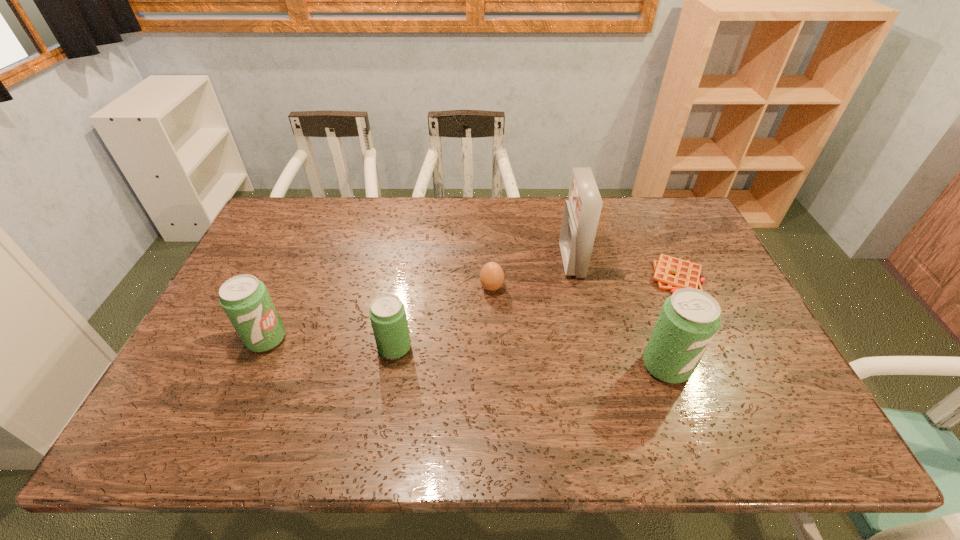
To achieve uniform spacing by inserting another pop_(soda) among them, please point to a free space for this new pop_(soda). Please provide its 2D coordinates. Your answer should be formatted as a tuple, i.e. [(x, y)], where the tuple contains the x and y coordinates of a point satisfying the conditions above.

[(528, 357)]